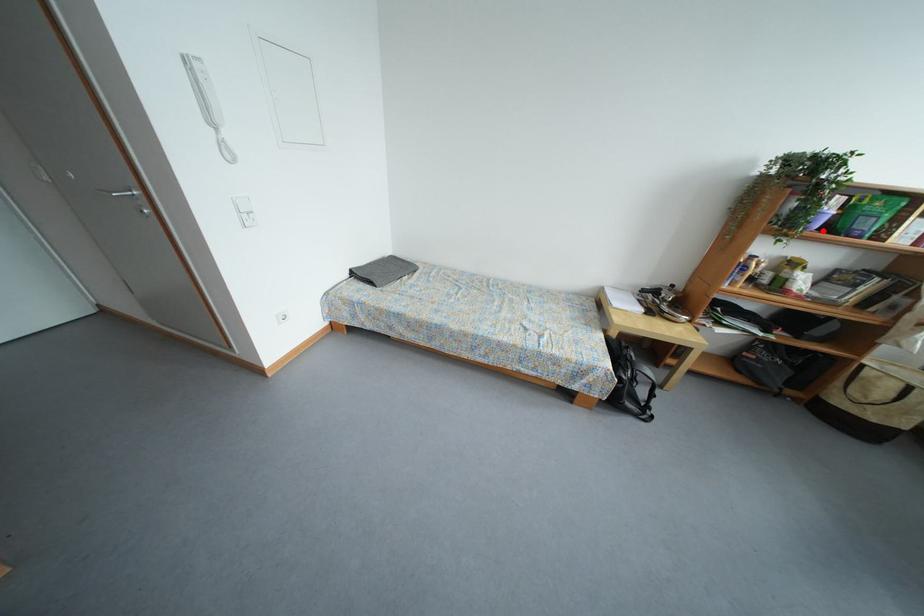
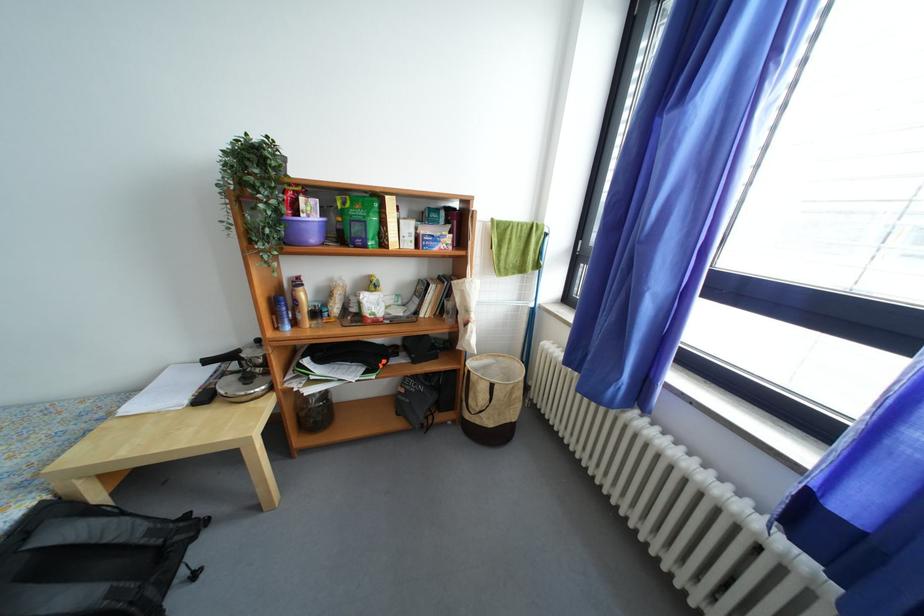
Locate, in the second image, the point that corresponds to the highlighted location in the first image.

(320, 243)